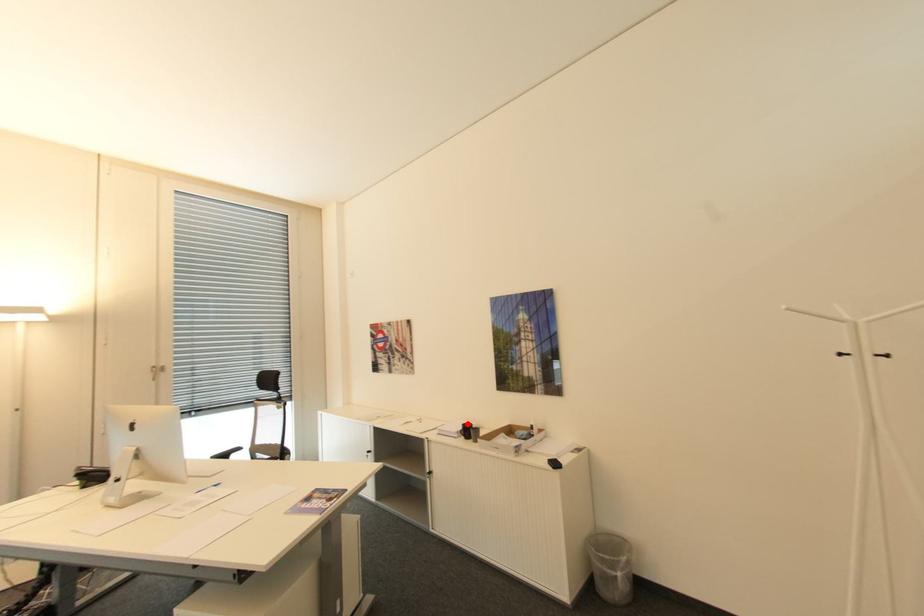
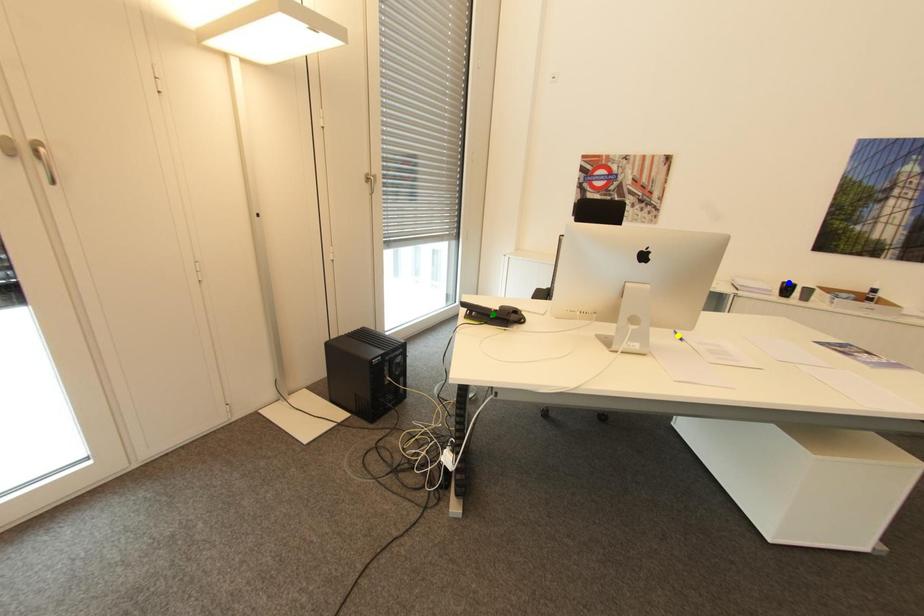
Question: I am providing you with two images of the same scene from different viewpoints. A red point is marked on the first image. You are given multiple points on the second image. Which point in image 2 represents the same 3d spot as the red point in image 1?

Choices:
 (A) yellow point
 (B) green point
 (C) blue point

Answer: (C)